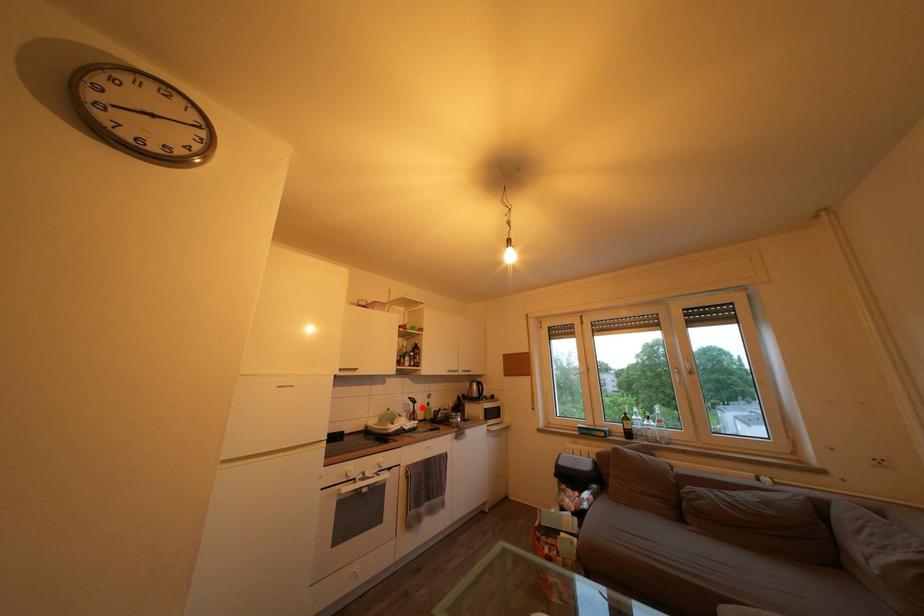
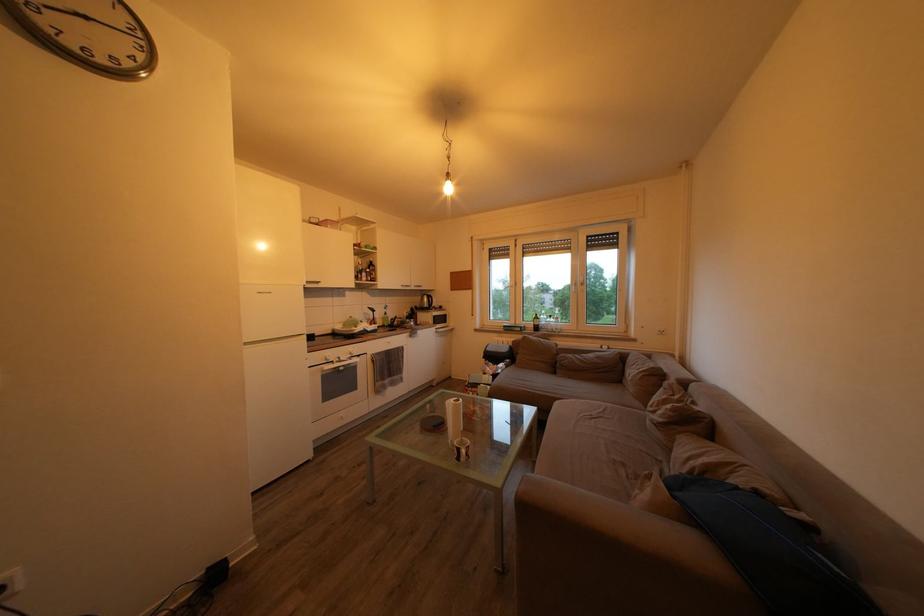
Locate, in the second image, the point that corresponds to the highlighted location in the first image.

(381, 317)